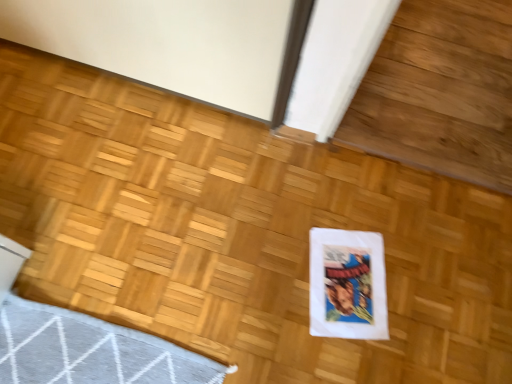
I want to click on free spot behind white paper comic book at lower right, so click(x=353, y=207).